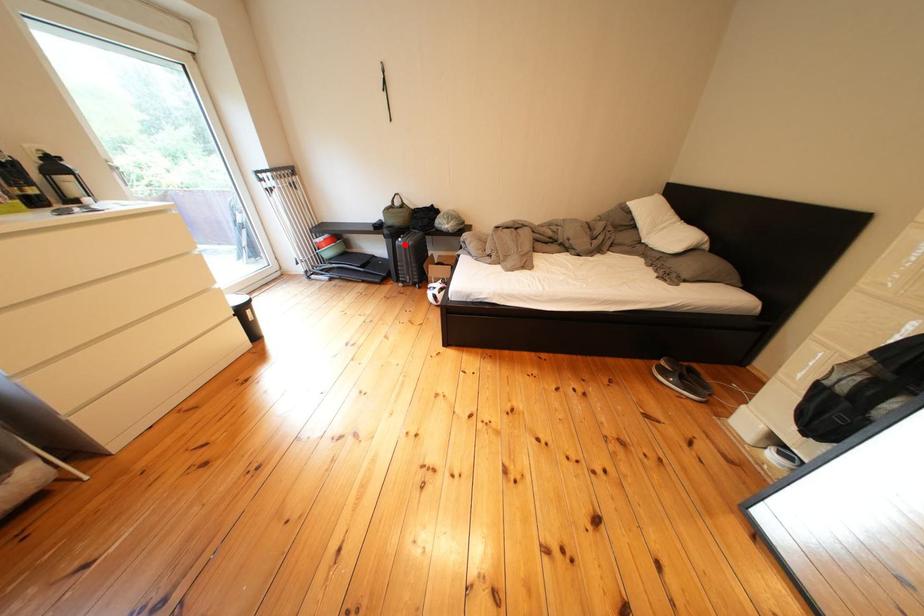
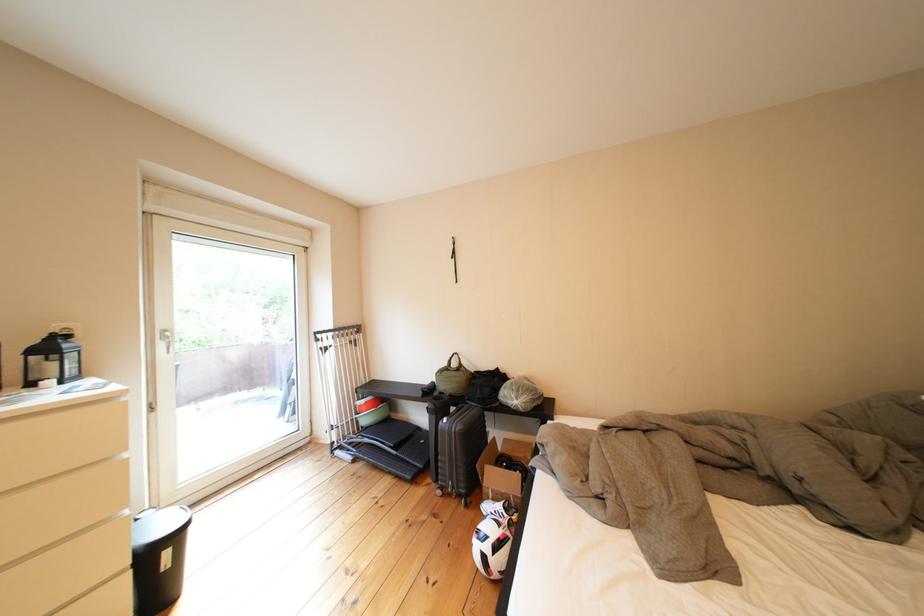
Locate, in the second image, the point that corresponds to the highlighted location in the first image.

(448, 422)